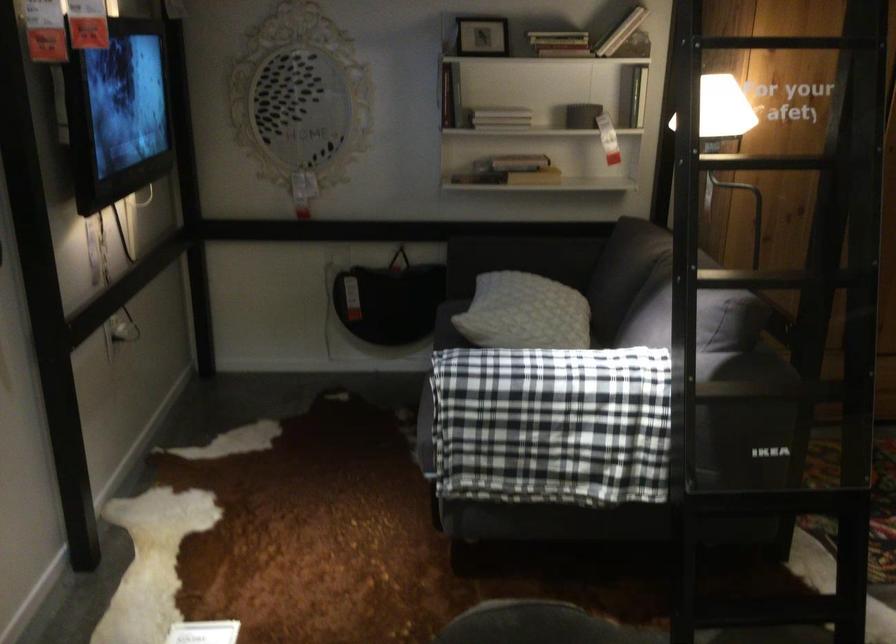
This screenshot has height=644, width=896. In order to click on black bag in this screenshot , I will do `click(390, 299)`.